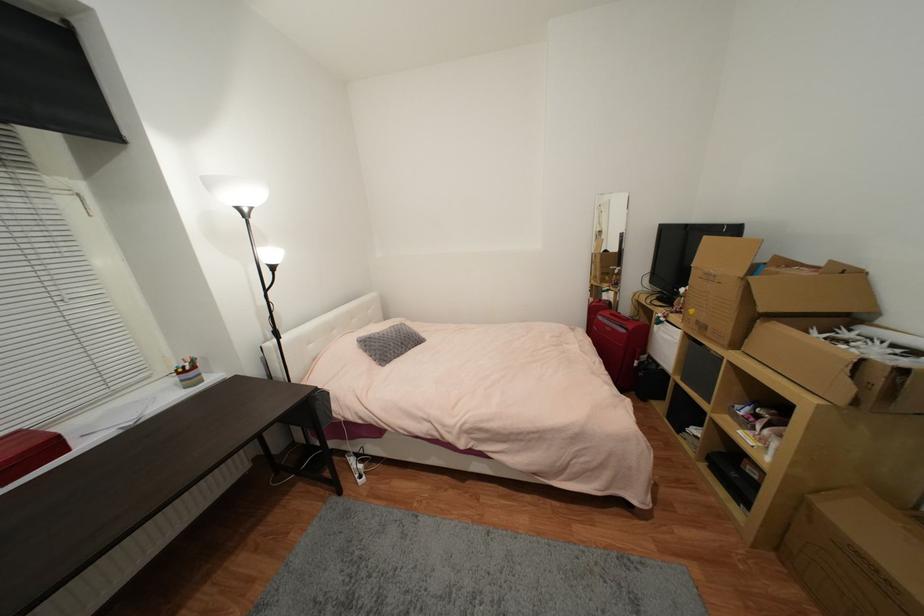
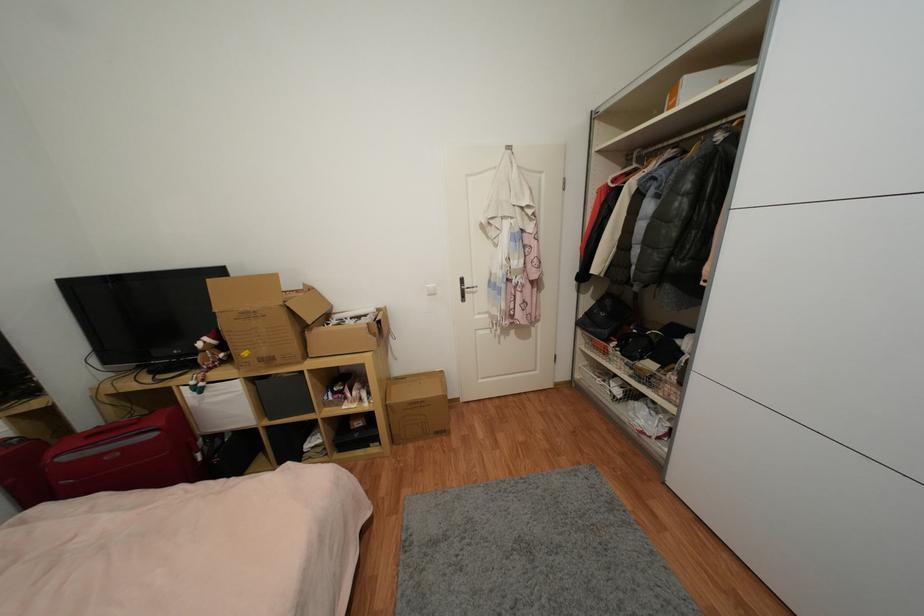
Where in the second image is the point corresponding to point 782,546 from the first image?

(397, 440)